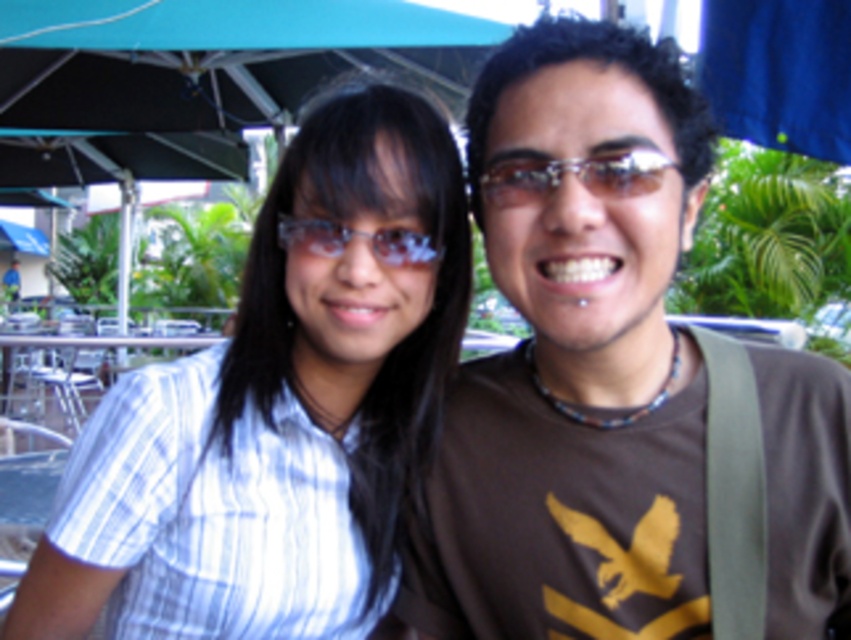
Question: Where is white striped shirt at center located in relation to sunglasses at center in the image?

Choices:
 (A) above
 (B) below

Answer: (B)

Question: Which point appears farthest from the camera in this image?

Choices:
 (A) click(204, 636)
 (B) click(592, 189)
 (C) click(410, 240)

Answer: (A)

Question: In this image, where is white striped shirt at center located relative to sunglasses at center?

Choices:
 (A) right
 (B) left

Answer: (B)

Question: Based on their relative distances, which object is farther from the white striped shirt at center?

Choices:
 (A) sunglasses at center
 (B) transparent plastic glasses at center

Answer: (A)

Question: Which point is closer to the camera taking this photo?

Choices:
 (A) (404, 230)
 (B) (591, 177)

Answer: (B)

Question: Does white striped shirt at center appear on the left side of sunglasses at center?

Choices:
 (A) no
 (B) yes

Answer: (B)